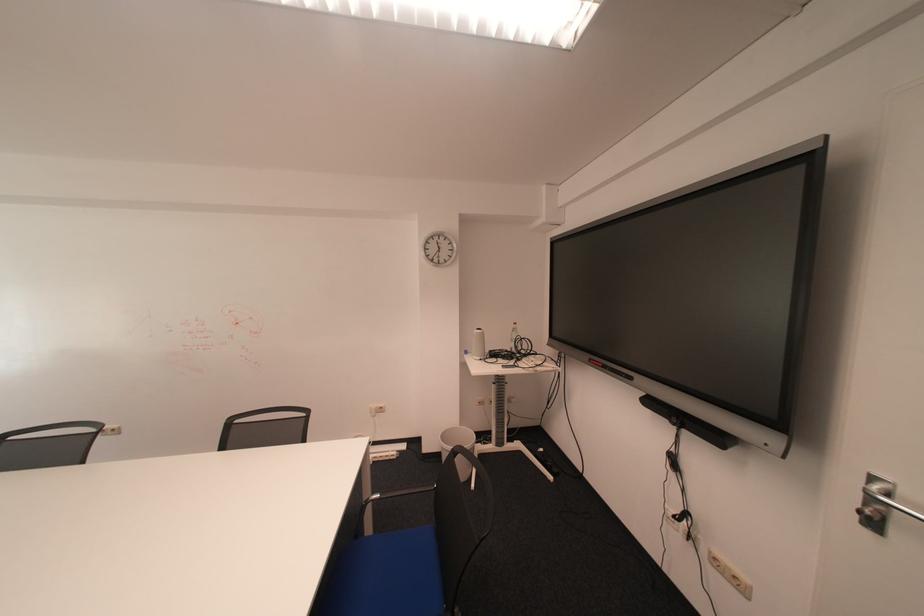
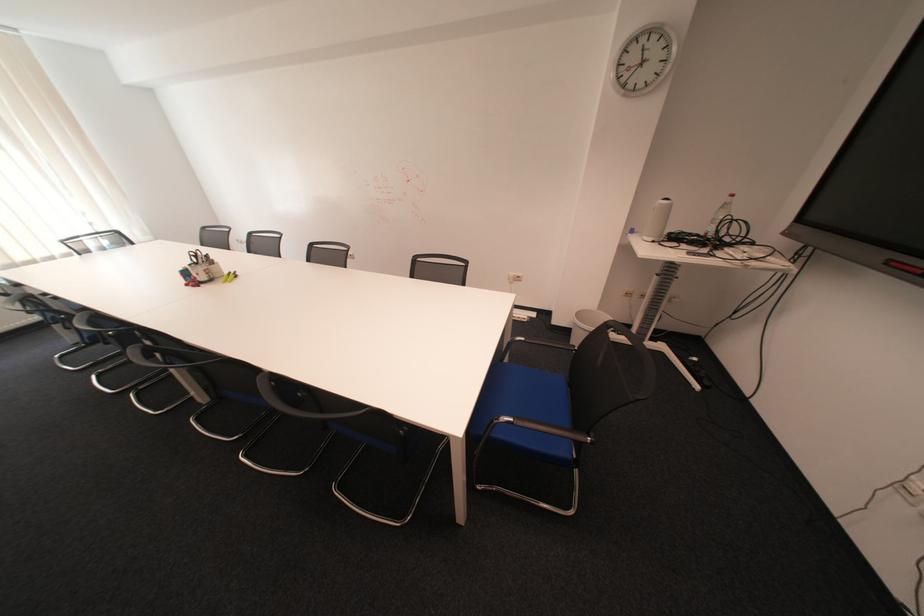
Where in the second image is the point corresponding to [456,437] from the first image?

(590, 315)